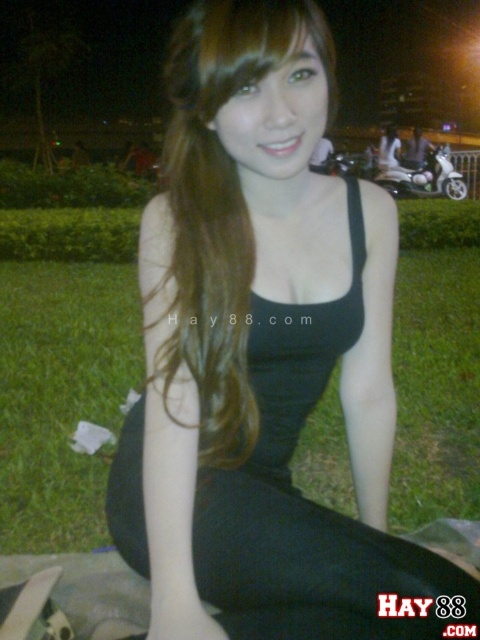
Question: Among these objects, which one is nearest to the camera?

Choices:
 (A) green grass at lower center
 (B) white glossy motorcycle at right
 (C) black matte dress at center

Answer: (C)

Question: Which point appears closest to the camera in this image?

Choices:
 (A) (69, 492)
 (B) (206, 300)

Answer: (B)

Question: Is black matte dress at center smaller than white glossy motorcycle at right?

Choices:
 (A) yes
 (B) no

Answer: (A)

Question: Does black matte dress at center appear on the right side of white glossy motorcycle at right?

Choices:
 (A) no
 (B) yes

Answer: (A)

Question: Considering the real-world distances, which object is closest to the white glossy motorcycle at right?

Choices:
 (A) black matte dress at center
 (B) green grass at lower center

Answer: (B)

Question: In this image, where is green grass at lower center located relative to black matte dress at center?

Choices:
 (A) below
 (B) above

Answer: (B)